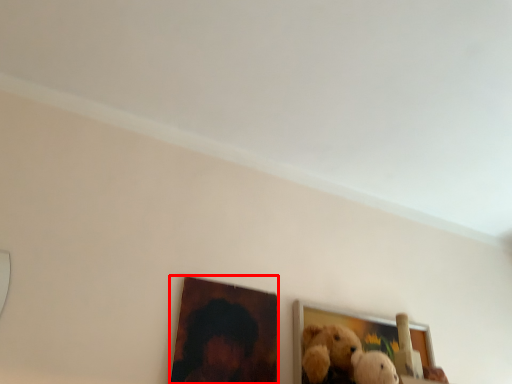
Question: From the image, what is the correct spatial relationship of picture frame (annotated by the red box) in relation to picture frame?

Choices:
 (A) left
 (B) right

Answer: (A)